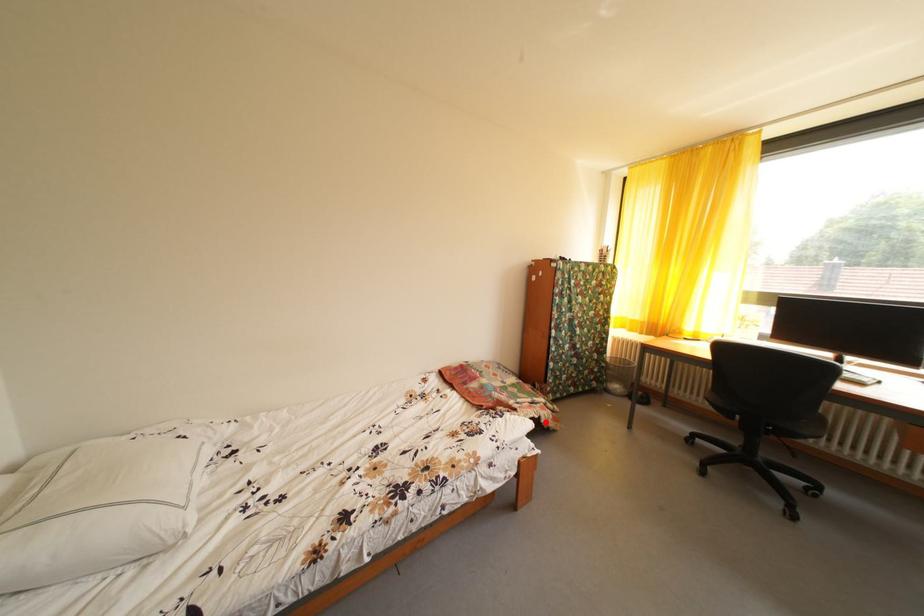
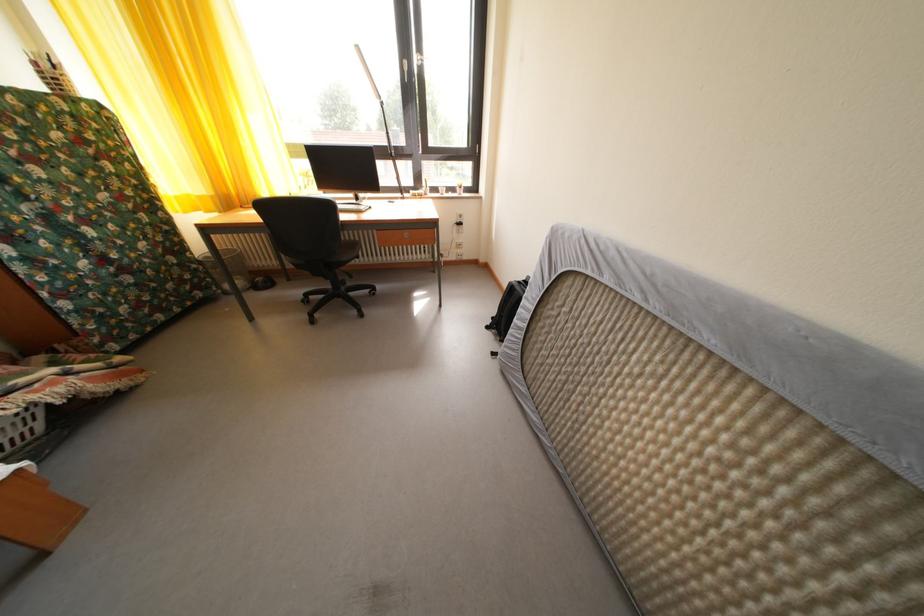
Question: A red point is marked in image1. In image2, is the corresponding 3D point closer to the camera or farther? Reply with the corresponding letter.

Choices:
 (A) The corresponding 3D point is closer.
 (B) The corresponding 3D point is farther.

Answer: (B)